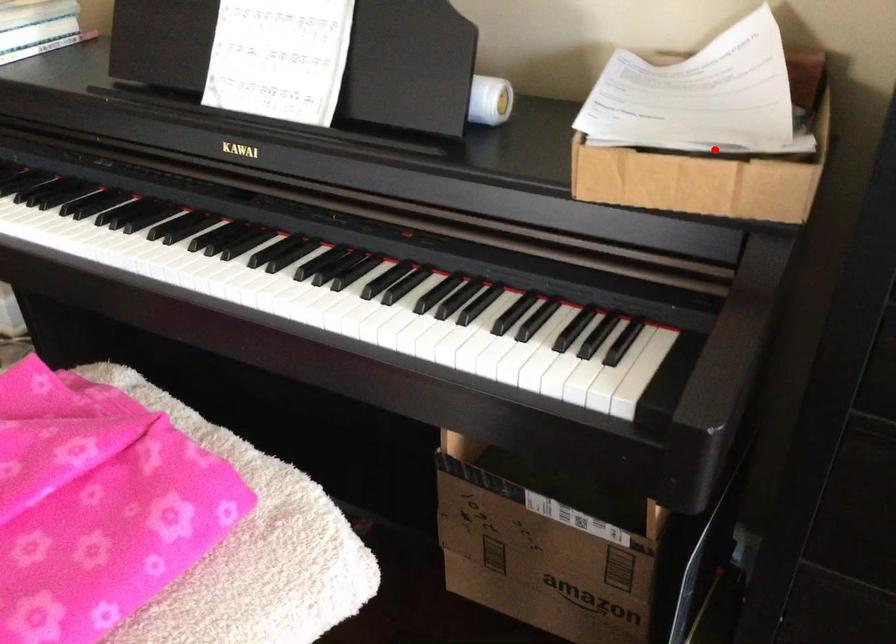
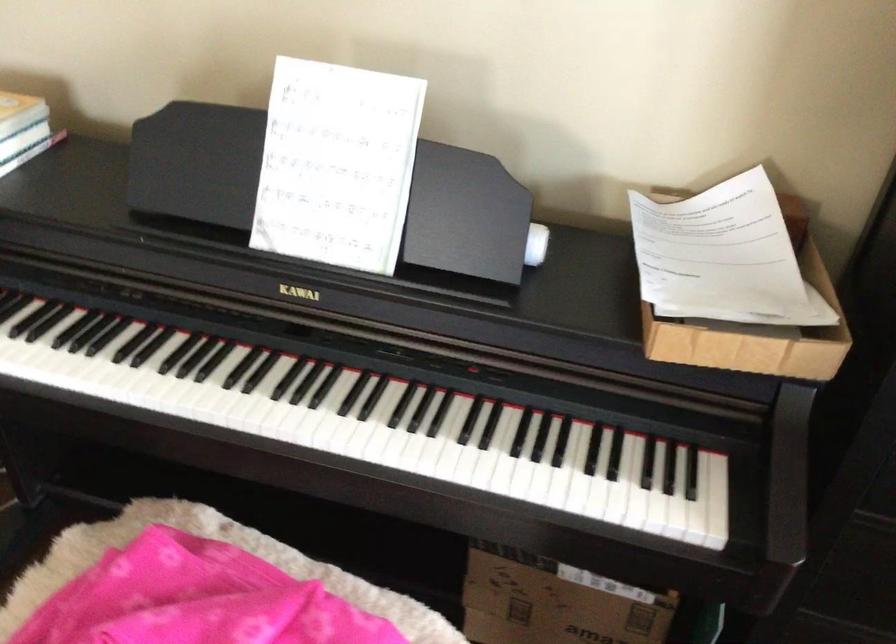
Find the pixel in the second image that matches the highlighted location in the first image.

(754, 316)